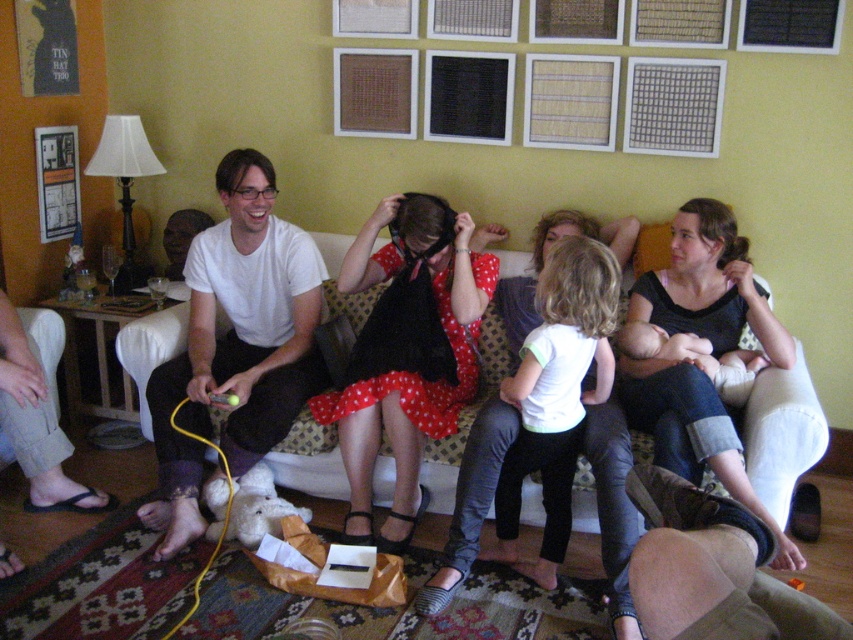
Is point (256, 163) positioned after point (688, 624)?

Yes.

Image resolution: width=853 pixels, height=640 pixels. Find the location of `white matte shirt at left`. white matte shirt at left is located at coordinates (236, 342).

Which is in front, point (158, 452) or point (759, 596)?

Positioned in front is point (759, 596).

Identify the location of white matte shirt at left. point(236,342).

Does white matte shirt at left have a lesser height compared to dark gray knit sweater at center?

No, white matte shirt at left is not shorter than dark gray knit sweater at center.

Does point (291, 308) lie in front of point (674, 218)?

No.

You are a GUI agent. You are given a task and a screenshot of the screen. Output one action in this format:
    pyautogui.click(x=<x>, y=<y>)
    Task: Click on the white matte shirt at left
    The image size is (853, 640).
    Given the screenshot: What is the action you would take?
    pyautogui.click(x=236, y=342)

Where is `polka dot dress at center`? The image size is (853, 640). polka dot dress at center is located at coordinates (405, 352).

Can you confirm if polka dot dress at center is wider than brown leather couch at lower right?

Yes, polka dot dress at center is wider than brown leather couch at lower right.

Describe the element at coordinates (405, 352) in the screenshot. I see `polka dot dress at center` at that location.

Identify the location of polka dot dress at center. The height and width of the screenshot is (640, 853). (405, 352).